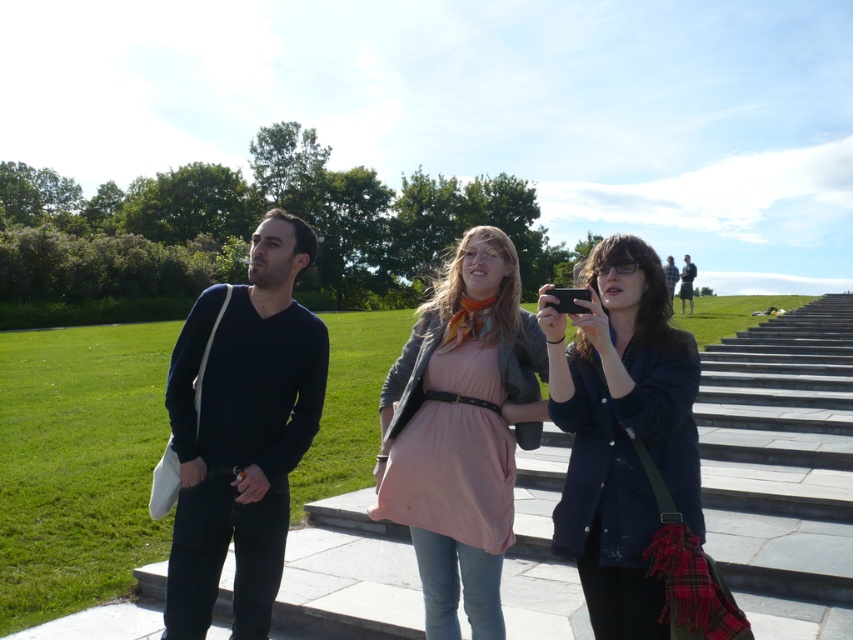
Question: Is dark blue sweater at center wider than pink fabric dress at center?

Choices:
 (A) yes
 (B) no

Answer: (A)

Question: Which point is closer to the camera?

Choices:
 (A) coord(531,364)
 (B) coord(202,604)
 (C) coord(682,280)

Answer: (B)

Question: Observing the image, what is the correct spatial positioning of pink fabric dress at center in reference to dark blue shirt at upper right?

Choices:
 (A) below
 (B) above

Answer: (A)

Question: Is matte black jacket at center below dark blue shirt at upper right?

Choices:
 (A) no
 (B) yes

Answer: (B)

Question: Which object is farther from the camera taking this photo?

Choices:
 (A) dark blue shirt at upper right
 (B) matte black jacket at center
 (C) dark blue sweater at center
 (D) pink fabric dress at center

Answer: (A)

Question: Which of these objects is positioned closest to the dark blue sweater at center?

Choices:
 (A) matte black jacket at center
 (B) pink fabric dress at center
 (C) dark blue shirt at upper right

Answer: (B)